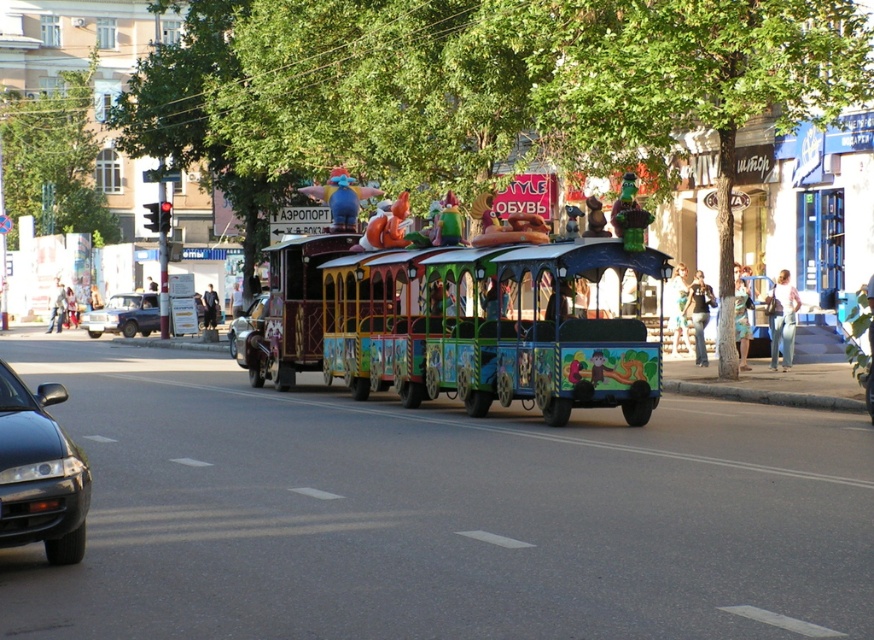
You are a pedestrian standing on the sidewalk and see the shiny silver car at center and the denim skirt at right. Which object is closer to you?

The shiny silver car at center is closer to you because the denim skirt at right is behind it.

You are standing in the middle of the street and want to take a photo of the whimsical train vehicle. There are two points marked on the ground in front of you at coordinates point (233, 333) and point (734, 296). Which point is closer to the camera so that you can place your tripod there for the best shot?

Point (233, 333) is further to the camera than point (734, 296). Therefore, placing the tripod at point (734, 296) would be closer to the camera, allowing for a better shot.

You are a delivery driver who needs to park your truck in the parking lot near the street. The parking lot has a designated spot at point 0.5, 0.15. Can you safely park your truck there if there is already a matte silver suv at left parked at its location?

The matte silver suv at left is parked at point (123, 316), which is very close to the designated spot at (130, 320). Depending on the size of your truck and the parking spot, there might be limited space. However, since the coordinates are nearly the same, it might be possible to park there with caution, ensuring not to encroach on the SUV.